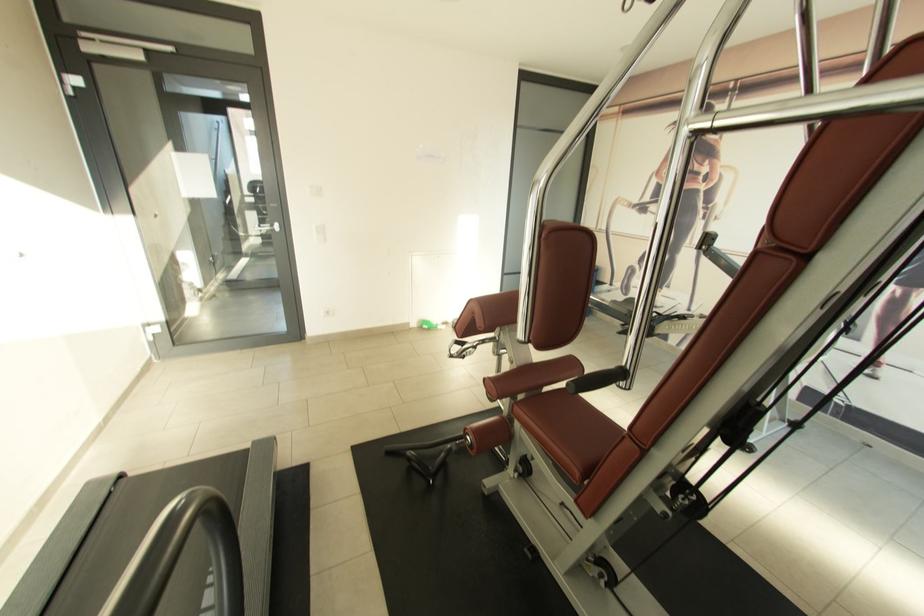
What do you see at coordinates (177, 541) in the screenshot? Image resolution: width=924 pixels, height=616 pixels. I see `the black machine handle` at bounding box center [177, 541].